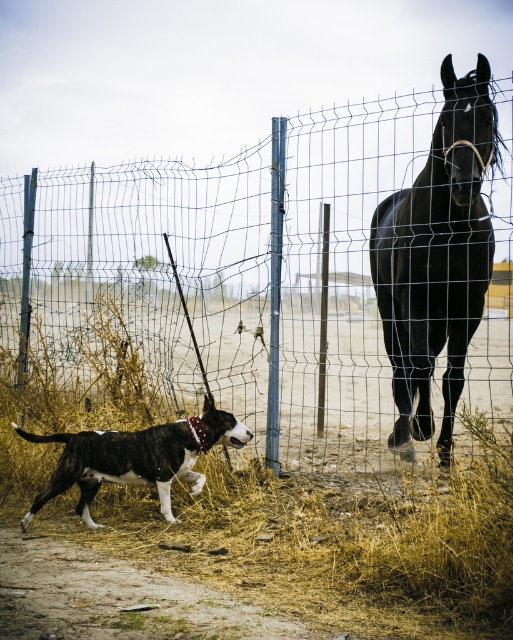
Question: Is wire mesh fence at center below black glossy horse at right?

Choices:
 (A) no
 (B) yes

Answer: (A)

Question: Which object is positioned farthest from the black-and-white fur dog at lower left?

Choices:
 (A) black glossy horse at right
 (B) brown dry grass at lower left
 (C) wire mesh fence at center

Answer: (C)

Question: Is wire mesh fence at center above brown dry grass at lower left?

Choices:
 (A) yes
 (B) no

Answer: (A)

Question: Which of the following is the farthest from the observer?

Choices:
 (A) (420, 236)
 (B) (142, 356)

Answer: (B)

Question: Can you confirm if brown dry grass at lower left is positioned below black-and-white fur dog at lower left?

Choices:
 (A) no
 (B) yes

Answer: (A)

Question: Estimate the real-world distances between objects in this image. Which object is farther from the black-and-white fur dog at lower left?

Choices:
 (A) wire mesh fence at center
 (B) brown dry grass at lower left

Answer: (A)